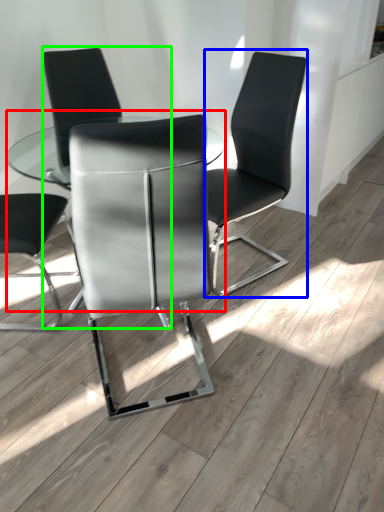
Question: Which object is the closest to the table (highlighted by a red box)? Choose among these: chair (highlighted by a blue box) or chair (highlighted by a green box).

Choices:
 (A) chair
 (B) chair

Answer: (B)